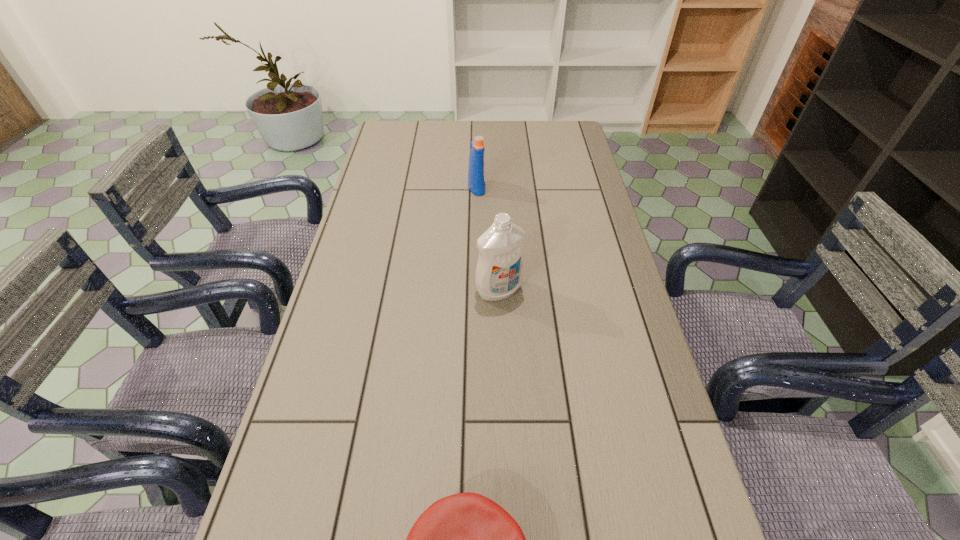
Locate which object ranks in proximity to the cap. Please provide its 2D coordinates. Your answer should be formatted as a tuple, i.e. [(x, y)], where the tuple contains the x and y coordinates of a point satisfying the conditions above.

[(499, 272)]

Identify which object is the nearest to the nearest object. Please provide its 2D coordinates. Your answer should be formatted as a tuple, i.e. [(x, y)], where the tuple contains the x and y coordinates of a point satisfying the conditions above.

[(499, 272)]

In order to click on vacant space that satisfies the following two spatial constraints: 1. on the label of the shorter detergent; 2. on the right side of the taller detergent in this screenshot , I will do `click(476, 290)`.

Locate an element on the screen. The height and width of the screenshot is (540, 960). vacant region that satisfies the following two spatial constraints: 1. on the label of the second shortest object; 2. on the left side of the second farthest object is located at coordinates pos(476,290).

You are a GUI agent. You are given a task and a screenshot of the screen. Output one action in this format:
    pyautogui.click(x=<x>, y=<y>)
    Task: Click on the free spot that satisfies the following two spatial constraints: 1. on the back side of the taller detergent; 2. on the label of the shorter detergent
    The image size is (960, 540).
    Given the screenshot: What is the action you would take?
    pyautogui.click(x=494, y=187)

Locate an element on the screen. Image resolution: width=960 pixels, height=540 pixels. vacant point that satisfies the following two spatial constraints: 1. on the back side of the second farthest object; 2. on the label of the second shortest object is located at coordinates (494, 187).

The image size is (960, 540). I want to click on vacant space that satisfies the following two spatial constraints: 1. on the label of the tallest object; 2. on the right side of the farther detergent, so click(476, 290).